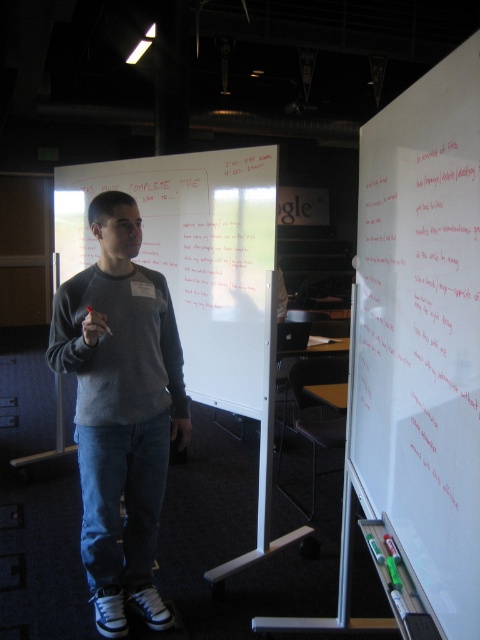
You are a student sitting in the classroom and need to write a note on the whiteboard. Which object is closer to you, the white matte whiteboard at right or the gray matte sweater at center?

The gray matte sweater at center is closer to you because it is positioned to the left of the white matte whiteboard at right.

Please provide the coordinates of the white matte whiteboard at right in the image. The coordinate system is based on the image width and height, with the origin at the bottom left corner. The coordinates are given as a tuple of two values between 0 and 1, representing the x and y positions respectively. Please answer with the coordinates in the format of a tuple, e.g., 0.5,0.5.

The coordinates of the white matte whiteboard at right are (420, 348).